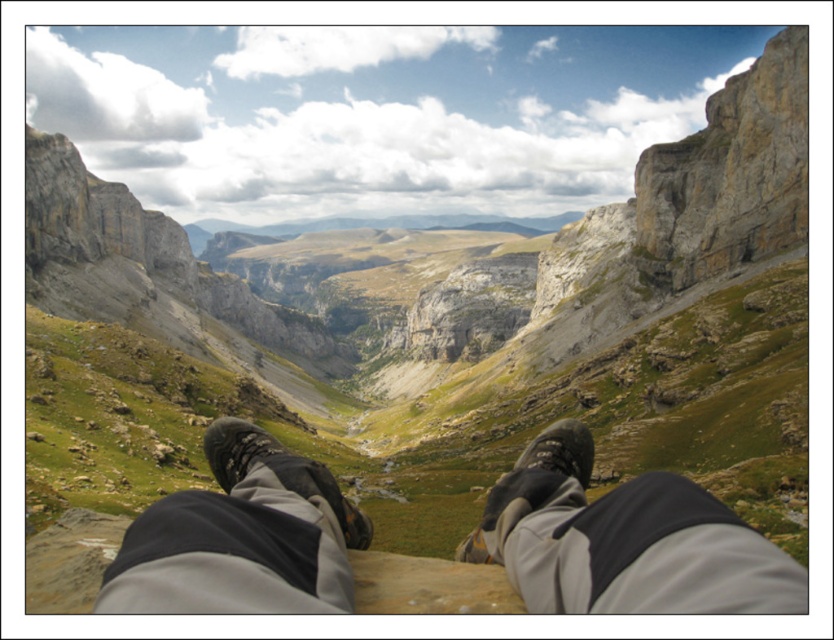
You are a hiker who just stopped to take a photo. You notice your gray fabric pants at lower center and matte gray boot at center. Which item is positioned higher from the ground?

The gray fabric pants at lower center is located above the matte gray boot at center, so it is positioned higher from the ground.

You are a hiker who just arrived at this scenic overlook. You notice your gray fabric pants at lower center and black suede boot at lower center. Which item is covering the other?

The gray fabric pants at lower center is positioned over the black suede boot at lower center, so the pants are covering the boot.